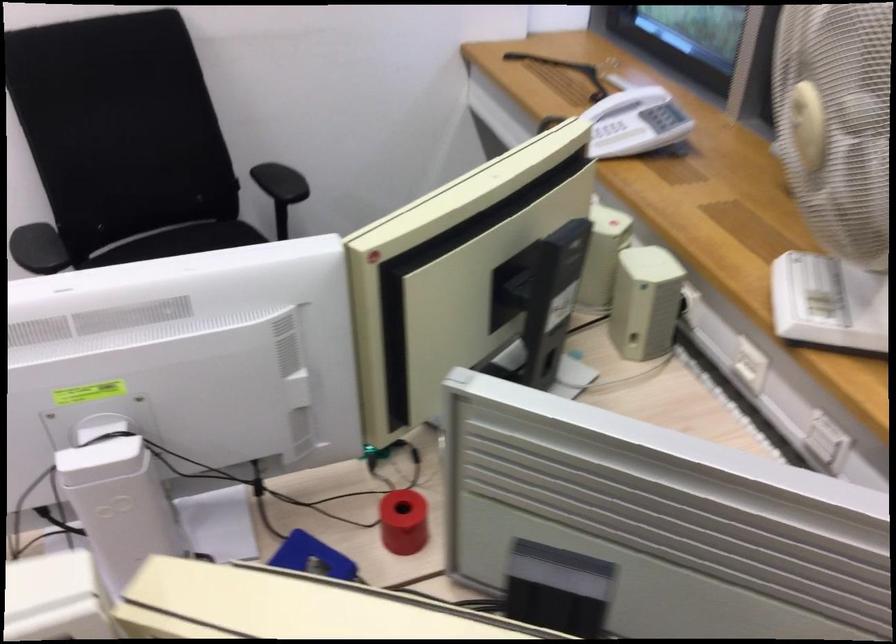
Find the location of a particular element. This screenshot has width=896, height=644. telephone handset is located at coordinates (634, 122).